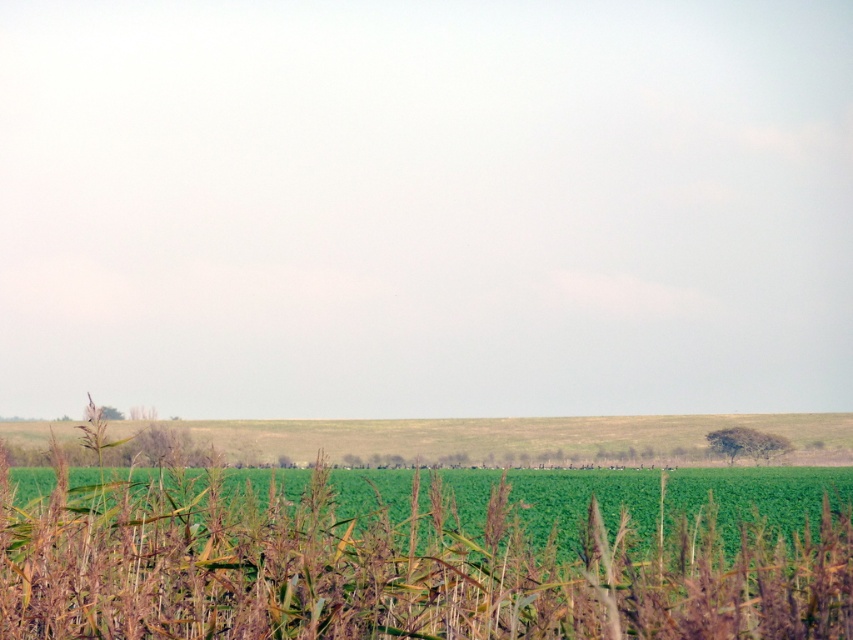
Question: Which point is farther from the camera taking this photo?

Choices:
 (A) (685, 413)
 (B) (421, 580)

Answer: (A)

Question: Does green matte corn field at center have a lesser width compared to green grass at lower center?

Choices:
 (A) no
 (B) yes

Answer: (B)

Question: Which of the following is the closest to the observer?

Choices:
 (A) (19, 424)
 (B) (654, 616)

Answer: (B)

Question: Does green matte corn field at center appear under green grass at lower center?

Choices:
 (A) no
 (B) yes

Answer: (A)

Question: Is green matte corn field at center positioned before green grass at lower center?

Choices:
 (A) no
 (B) yes

Answer: (B)